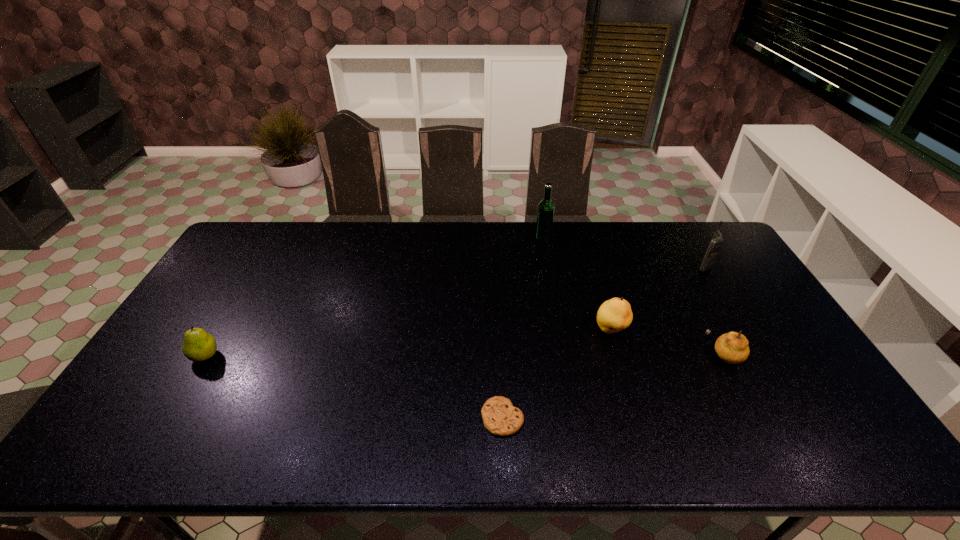
At what (x,y) coordinates should I click in order to perform the action: click on beer bottle. Please return your answer as a coordinate pair (x, y). Looking at the image, I should click on (545, 213).

This screenshot has width=960, height=540. I want to click on the farthest object, so click(545, 213).

The height and width of the screenshot is (540, 960). I want to click on the fifth shortest object, so click(717, 240).

Locate an element on the screen. The width and height of the screenshot is (960, 540). cellular telephone is located at coordinates (717, 240).

The image size is (960, 540). What are the coordinates of `the third object from right to left` in the screenshot? It's located at (614, 315).

I want to click on the leftmost object, so click(x=198, y=345).

This screenshot has width=960, height=540. In order to click on the rightmost pear in this screenshot , I will do `click(732, 347)`.

Where is `the nearest object`? the nearest object is located at coordinates (500, 417).

At what (x,y) coordinates should I click in order to perform the action: click on the fifth object from right to left. Please return your answer as a coordinate pair (x, y). Image resolution: width=960 pixels, height=540 pixels. Looking at the image, I should click on (500, 417).

What are the coordinates of `free space located on the right of the fourth object from right to left` in the screenshot? It's located at (651, 237).